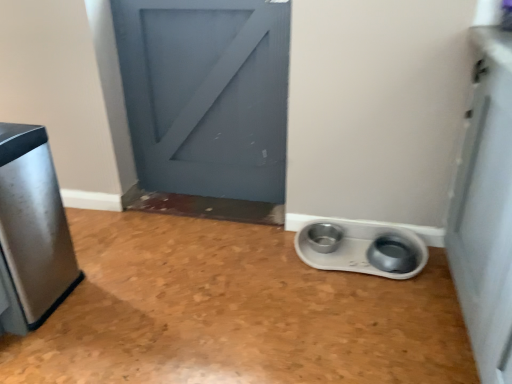
This screenshot has width=512, height=384. Find the location of `free space in front of white plastic pet bowls at lower right`. free space in front of white plastic pet bowls at lower right is located at coordinates (371, 314).